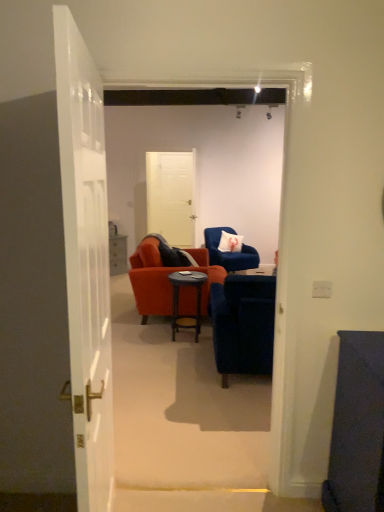
Find the location of `white fabric pillow at center`. white fabric pillow at center is located at coordinates (230, 242).

What do you see at coordinates (229, 252) in the screenshot?
I see `velvet blue armchair at center, which is the 2th chair from front to back` at bounding box center [229, 252].

The image size is (384, 512). What do you see at coordinates (178, 297) in the screenshot?
I see `dark wood side table at center` at bounding box center [178, 297].

What is the approximate height of dark wood side table at center?

It is 24.57 inches.

The image size is (384, 512). I want to click on velvet blue armchair at center, which appears as the 1th chair when viewed from the front, so click(243, 325).

Does velvet blue armchair at center, which is the 2th chair from front to back, have a smaller size compared to white glossy door at left, the 1th door from the bottom?

No, velvet blue armchair at center, which is the 2th chair from front to back, is not smaller than white glossy door at left, the 1th door from the bottom.

Does velvet blue armchair at center, marked as the first chair in a back-to-front arrangement, lie behind white glossy door at left, the 2th door viewed from the top?

Yes, it is.

Measure the distance between velvet blue armchair at center, which is the 2th chair from front to back, and white glossy door at left, the 1th door from the bottom.

velvet blue armchair at center, which is the 2th chair from front to back, and white glossy door at left, the 1th door from the bottom, are 2.82 meters apart.

Which is behind, point (86, 82) or point (213, 290)?

Point (213, 290)

Consider the image. Does white glossy door at left, the 2th door viewed from the top, have a larger size compared to velvet blue armchair at center, the second chair viewed from the back?

Actually, white glossy door at left, the 2th door viewed from the top, might be smaller than velvet blue armchair at center, the second chair viewed from the back.

In order to click on the 1st door above the velvet blue armchair at center, the second chair viewed from the back (from a real-world perspective) in this screenshot , I will do `click(86, 261)`.

Is white fabric pillow at center looking in the opposite direction of velvet blue armchair at center, the second chair viewed from the back?

That's not correct — white fabric pillow at center is not looking away from velvet blue armchair at center, the second chair viewed from the back.

Identify the location of the 1st chair located beneath the white fabric pillow at center (from a real-world perspective). Image resolution: width=384 pixels, height=512 pixels. click(x=243, y=325).

Which point is more forward, (x=233, y=241) or (x=263, y=296)?

Point (x=263, y=296)

Would you say white fabric pillow at center is to the left or to the right of velvet blue armchair at center, the second chair viewed from the back, in the picture?

white fabric pillow at center is positioned on velvet blue armchair at center, the second chair viewed from the back,'s right side.

Considering the positions of points (176, 272) and (175, 198), is point (176, 272) closer to camera compared to point (175, 198)?

Yes, point (176, 272) is in front of point (175, 198).

Does dark wood side table at center appear on the left side of white matte door at center, which appears as the second door when viewed from the front?

Incorrect, dark wood side table at center is not on the left side of white matte door at center, which appears as the second door when viewed from the front.

From a real-world perspective, is dark wood side table at center positioned under white matte door at center, the 2th door ordered from the bottom, based on gravity?

Indeed, from a real-world perspective, dark wood side table at center is positioned beneath white matte door at center, the 2th door ordered from the bottom.

Is white matte door at center, which appears as the second door when viewed from the front, surrounded by white glossy door at left, arranged as the 2th door when viewed from the back?

No, white matte door at center, which appears as the second door when viewed from the front, is not surrounded by white glossy door at left, arranged as the 2th door when viewed from the back.

Is white glossy door at left, arranged as the 2th door when viewed from the back, positioned far away from white matte door at center, placed as the first door when sorted from back to front?

Yes, white glossy door at left, arranged as the 2th door when viewed from the back, and white matte door at center, placed as the first door when sorted from back to front, are quite far apart.

From the image's perspective, is white glossy door at left, the 1th door from the bottom, located above or below white matte door at center, the 2th door ordered from the bottom?

white glossy door at left, the 1th door from the bottom, is situated lower than white matte door at center, the 2th door ordered from the bottom, in the image.

Looking at this image, considering the relative sizes of velvet blue armchair at center, marked as the first chair in a back-to-front arrangement, and white fabric pillow at center in the image provided, is velvet blue armchair at center, marked as the first chair in a back-to-front arrangement, bigger than white fabric pillow at center?

Yes.

From a real-world perspective, does velvet blue armchair at center, marked as the first chair in a back-to-front arrangement, stand above white fabric pillow at center?

No, from a real-world perspective, velvet blue armchair at center, marked as the first chair in a back-to-front arrangement, is not over white fabric pillow at center

Between velvet blue armchair at center, which is the 2th chair from front to back, and white fabric pillow at center, which one has larger width?

velvet blue armchair at center, which is the 2th chair from front to back.

How different are the orientations of velvet blue armchair at center, which is the 2th chair from front to back, and white fabric pillow at center in degrees?

The angle between the facing direction of velvet blue armchair at center, which is the 2th chair from front to back, and the facing direction of white fabric pillow at center is 0.00646 degrees.

Measure the distance between dark wood side table at center and velvet blue armchair at center, the second chair viewed from the back.

dark wood side table at center is 3.47 feet away from velvet blue armchair at center, the second chair viewed from the back.

Which of these two, dark wood side table at center or velvet blue armchair at center, which appears as the 1th chair when viewed from the front, is wider?

Wider between the two is velvet blue armchair at center, which appears as the 1th chair when viewed from the front.

Is the position of dark wood side table at center less distant than that of velvet blue armchair at center, the second chair viewed from the back?

No, dark wood side table at center is further to the viewer.

Does dark wood side table at center have a greater height compared to velvet blue armchair at center, which appears as the 1th chair when viewed from the front?

No.

Where is `door below the velvet blue armchair at center, which is the 2th chair from front to back (from the image's perspective)`? This screenshot has height=512, width=384. door below the velvet blue armchair at center, which is the 2th chair from front to back (from the image's perspective) is located at coordinates (86, 261).

At what (x,y) coordinates should I click in order to perform the action: click on door in front of the velvet blue armchair at center, which appears as the 1th chair when viewed from the front. Please return your answer as a coordinate pair (x, y). The image size is (384, 512). Looking at the image, I should click on (86, 261).

Which object lies nearer to the anchor point white fabric pillow at center, white matte door at center, the 2th door ordered from the bottom, or dark wood side table at center?

dark wood side table at center.

Considering their positions, is white fabric pillow at center positioned further to white matte door at center, the 2th door ordered from the bottom, than velvet blue armchair at center, the second chair viewed from the back?

velvet blue armchair at center, the second chair viewed from the back, lies further to white matte door at center, the 2th door ordered from the bottom, than the other object.

Estimate the real-world distances between objects in this image. Which object is further from white fabric pillow at center, white matte door at center, the first door viewed from the top, or velvet blue armchair at center, the second chair viewed from the back?

Among the two, velvet blue armchair at center, the second chair viewed from the back, is located further to white fabric pillow at center.

Looking at the image, which one is located closer to white matte door at center, the first door viewed from the top, velvet blue armchair at center, marked as the first chair in a back-to-front arrangement, or white glossy door at left, the 1th door from the bottom?

velvet blue armchair at center, marked as the first chair in a back-to-front arrangement, lies closer to white matte door at center, the first door viewed from the top, than the other object.

From the image, which object appears to be nearer to white fabric pillow at center, velvet blue armchair at center, which appears as the 1th chair when viewed from the front, or white matte door at center, which appears as the second door when viewed from the front?

Among the two, white matte door at center, which appears as the second door when viewed from the front, is located nearer to white fabric pillow at center.

From the image, which object appears to be nearer to white fabric pillow at center, white glossy door at left, arranged as the 2th door when viewed from the back, or dark wood side table at center?

dark wood side table at center is closer to white fabric pillow at center.

Based on the photo, looking at the image, which one is located closer to velvet blue armchair at center, which is the 2th chair from front to back, white glossy door at left, marked as the first door in a front-to-back arrangement, or white fabric pillow at center?

white fabric pillow at center lies closer to velvet blue armchair at center, which is the 2th chair from front to back, than the other object.

In the scene shown: Which object lies further to the anchor point white fabric pillow at center, velvet blue armchair at center, the second chair viewed from the back, or dark wood side table at center?

velvet blue armchair at center, the second chair viewed from the back, is further to white fabric pillow at center.

Locate an element on the screen. pillow between dark wood side table at center and white matte door at center, the first door viewed from the top, along the z-axis is located at coordinates (230, 242).

The height and width of the screenshot is (512, 384). What are the coordinates of `desk between velvet blue armchair at center, which appears as the 1th chair when viewed from the front, and velvet blue armchair at center, which is the 2th chair from front to back, along the z-axis` in the screenshot? It's located at (178, 297).

Identify the location of pillow located between velvet blue armchair at center, which appears as the 1th chair when viewed from the front, and white matte door at center, the first door viewed from the top, in the depth direction. The width and height of the screenshot is (384, 512). (230, 242).

The height and width of the screenshot is (512, 384). Identify the location of chair located between velvet blue armchair at center, the second chair viewed from the back, and white fabric pillow at center in the depth direction. (229, 252).